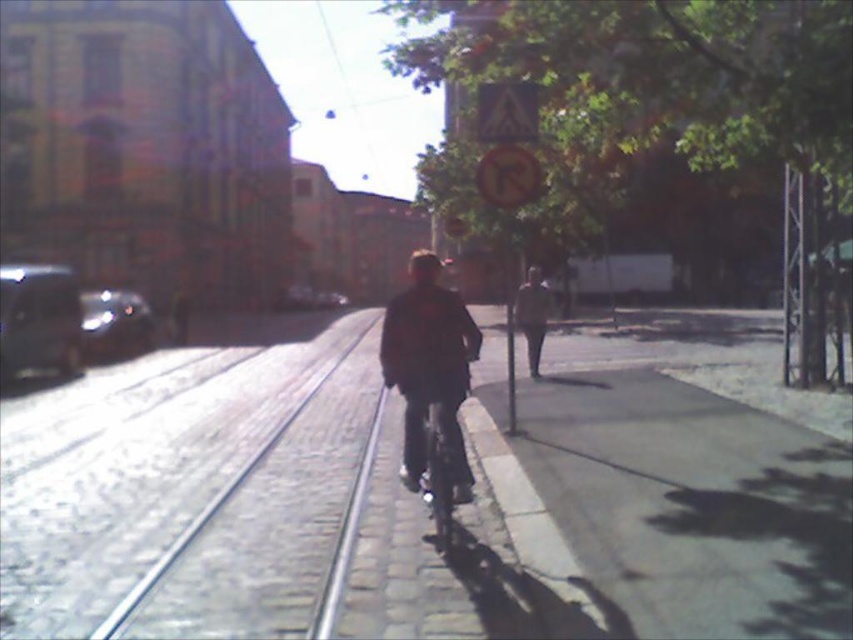
You are a delivery person trying to navigate a narrow path. You see the gray concrete sidewalk at center and the dark brown leather jacket at center. Which one has a wider width?

The dark brown leather jacket at center is wider than the gray concrete sidewalk at center.

You are standing at the edge of the gray concrete sidewalk at center and want to reach the dark brown leather jacket at center. Which direction should you move to get there?

You should move to the left to reach the dark brown leather jacket at center because the gray concrete sidewalk at center is to the right of it.

You are standing at the camera position and want to reach the point at coordinates (254, 458). If you walk straight towards it, how far will you have to walk?

The point at coordinates (254, 458) is 7.94 meters away from the camera, so you will have to walk 7.94 meters straight to reach it.